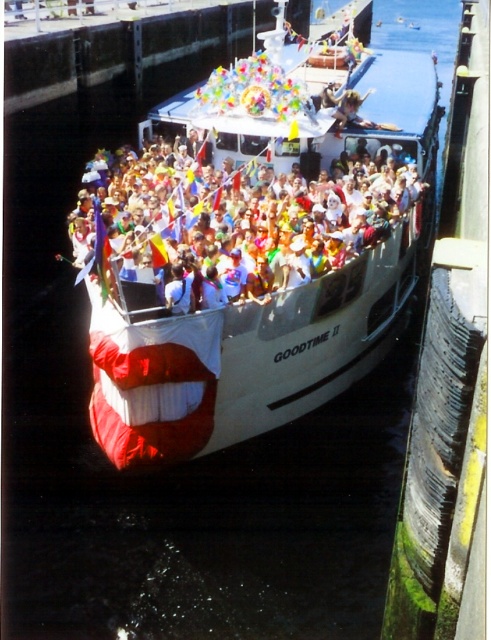
Where is `white matte boat at center`? Image resolution: width=491 pixels, height=640 pixels. white matte boat at center is located at coordinates (252, 253).

At what (x,y) coordinates should I click in order to perform the action: click on white matte boat at center. Please return your answer as a coordinate pair (x, y). Looking at the image, I should click on (252, 253).